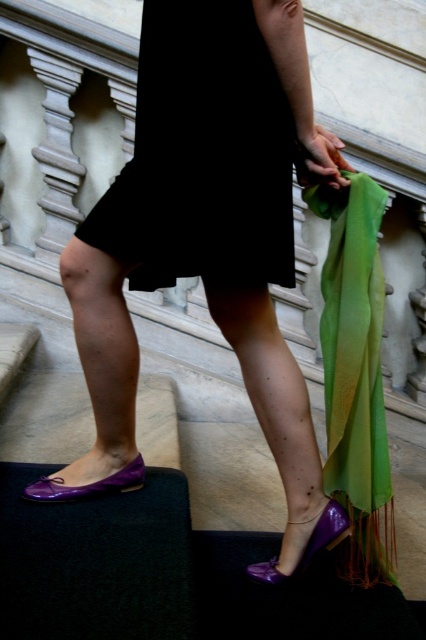
Question: Among these objects, which one is farthest from the camera?

Choices:
 (A) green silky scarf at center
 (B) purple glossy shoes at lower left

Answer: (A)

Question: Can you confirm if black matte dress at center is thinner than green silky scarf at center?

Choices:
 (A) yes
 (B) no

Answer: (B)

Question: Which point is farther from the camera taking this photo?

Choices:
 (A) (325, 323)
 (B) (244, 48)
 (C) (115, 492)

Answer: (C)

Question: Does purple glossy shoes at lower left appear over purple glossy flat shoe at lower left?

Choices:
 (A) yes
 (B) no

Answer: (A)

Question: Is purple glossy shoes at lower left positioned behind green silky scarf at center?

Choices:
 (A) yes
 (B) no

Answer: (B)

Question: Which object is farther from the camera taking this photo?

Choices:
 (A) black matte dress at center
 (B) green silky scarf at center

Answer: (B)